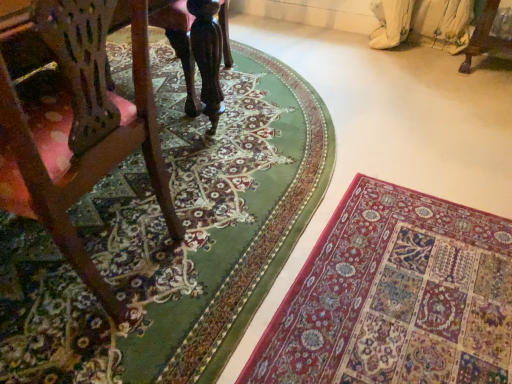
Image resolution: width=512 pixels, height=384 pixels. Describe the element at coordinates (169, 238) in the screenshot. I see `carpeted floor at lower right, the 1th mat when ordered from left to right` at that location.

The image size is (512, 384). What do you see at coordinates (75, 122) in the screenshot? I see `wooden chair at left` at bounding box center [75, 122].

The height and width of the screenshot is (384, 512). What are the coordinates of `carpeted floor at lower right, the 1th mat when ordered from left to right` in the screenshot? It's located at [x=169, y=238].

Is rich red carpet at lower right, the 2th mat in the left-to-right sequence, shorter than wooden chair at left?

Yes, rich red carpet at lower right, the 2th mat in the left-to-right sequence, is shorter than wooden chair at left.

Identify the location of the 1st mat behind the wooden chair at left, counting from the anchor's position. (395, 297).

Is rich red carpet at lower right, the 2th mat in the left-to-right sequence, next to wooden chair at left and touching it?

No, rich red carpet at lower right, the 2th mat in the left-to-right sequence, is not beside wooden chair at left.

Looking at this image, could you tell me if rich red carpet at lower right, the 2th mat in the left-to-right sequence, is facing wooden chair at left?

No, rich red carpet at lower right, the 2th mat in the left-to-right sequence, is not aimed at wooden chair at left.

Based on the photo, from a real-world perspective, is wooden chair at left physically located above or below carpeted floor at lower right, the second mat when ordered from right to left?

From a real-world perspective, wooden chair at left is physically above carpeted floor at lower right, the second mat when ordered from right to left.

Are wooden chair at left and carpeted floor at lower right, the second mat when ordered from right to left, far apart?

wooden chair at left is actually quite close to carpeted floor at lower right, the second mat when ordered from right to left.

Could you measure the distance between wooden chair at left and carpeted floor at lower right, the 1th mat when ordered from left to right?

wooden chair at left and carpeted floor at lower right, the 1th mat when ordered from left to right, are 17.44 inches apart.

Is wooden chair at left further to camera compared to carpeted floor at lower right, the second mat when ordered from right to left?

No.

How different are the orientations of carpeted floor at lower right, the second mat when ordered from right to left, and rich red carpet at lower right, the 2th mat in the left-to-right sequence, in degrees?

carpeted floor at lower right, the second mat when ordered from right to left, and rich red carpet at lower right, the 2th mat in the left-to-right sequence, are facing 1.25 degrees away from each other.

From the image's perspective, relative to rich red carpet at lower right, positioned as the first mat in right-to-left order, is carpeted floor at lower right, the second mat when ordered from right to left, above or below?

Clearly, from the image's perspective, carpeted floor at lower right, the second mat when ordered from right to left, is above rich red carpet at lower right, positioned as the first mat in right-to-left order.

In terms of width, does carpeted floor at lower right, the second mat when ordered from right to left, look wider or thinner when compared to rich red carpet at lower right, positioned as the first mat in right-to-left order?

In the image, carpeted floor at lower right, the second mat when ordered from right to left, appears to be wider than rich red carpet at lower right, positioned as the first mat in right-to-left order.

Are carpeted floor at lower right, the second mat when ordered from right to left, and rich red carpet at lower right, the 2th mat in the left-to-right sequence, located far from each other?

No, carpeted floor at lower right, the second mat when ordered from right to left, is not far away from rich red carpet at lower right, the 2th mat in the left-to-right sequence.

Is wooden chair at left far from rich red carpet at lower right, positioned as the first mat in right-to-left order?

wooden chair at left is actually quite close to rich red carpet at lower right, positioned as the first mat in right-to-left order.

From the image's perspective, is wooden chair at left on top of rich red carpet at lower right, positioned as the first mat in right-to-left order?

Correct, wooden chair at left appears higher than rich red carpet at lower right, positioned as the first mat in right-to-left order, in the image.

Between wooden chair at left and rich red carpet at lower right, positioned as the first mat in right-to-left order, which one appears on the right side from the viewer's perspective?

rich red carpet at lower right, positioned as the first mat in right-to-left order.

How different are the orientations of wooden chair at left and rich red carpet at lower right, the 2th mat in the left-to-right sequence, in degrees?

The angular difference between wooden chair at left and rich red carpet at lower right, the 2th mat in the left-to-right sequence, is 3.91 degrees.

Based on their positions, is carpeted floor at lower right, the 1th mat when ordered from left to right, located to the left or right of wooden chair at left?

Based on their positions, carpeted floor at lower right, the 1th mat when ordered from left to right, is located to the right of wooden chair at left.

From the image's perspective, which is below, carpeted floor at lower right, the second mat when ordered from right to left, or wooden chair at left?

wooden chair at left.

You are a GUI agent. You are given a task and a screenshot of the screen. Output one action in this format:
    pyautogui.click(x=<x>, y=<y>)
    Task: Click on the mat above the wooden chair at left (from the image's perspective)
    
    Given the screenshot: What is the action you would take?
    pyautogui.click(x=169, y=238)

Is carpeted floor at lower right, the 1th mat when ordered from left to right, positioned in front of wooden chair at left?

No, it is not.

Image resolution: width=512 pixels, height=384 pixels. In order to click on mat beneath the carpeted floor at lower right, the second mat when ordered from right to left (from a real-world perspective) in this screenshot , I will do `click(395, 297)`.

Can you confirm if rich red carpet at lower right, positioned as the first mat in right-to-left order, is bigger than carpeted floor at lower right, the 1th mat when ordered from left to right?

No.

In terms of height, does rich red carpet at lower right, the 2th mat in the left-to-right sequence, look taller or shorter compared to carpeted floor at lower right, the 1th mat when ordered from left to right?

rich red carpet at lower right, the 2th mat in the left-to-right sequence, is shorter than carpeted floor at lower right, the 1th mat when ordered from left to right.

Does rich red carpet at lower right, positioned as the first mat in right-to-left order, turn towards carpeted floor at lower right, the second mat when ordered from right to left?

Yes, rich red carpet at lower right, positioned as the first mat in right-to-left order, is turned towards carpeted floor at lower right, the second mat when ordered from right to left.

At what (x,y) coordinates should I click in order to perform the action: click on the 2nd mat directly beneath the wooden chair at left (from a real-world perspective). Please return your answer as a coordinate pair (x, y). This screenshot has height=384, width=512. Looking at the image, I should click on (395, 297).

From the wooden chair at left, count 2nd mats backward and point to it. Please provide its 2D coordinates.

[(169, 238)]

Which object lies further to the anchor point carpeted floor at lower right, the second mat when ordered from right to left, rich red carpet at lower right, the 2th mat in the left-to-right sequence, or wooden chair at left?

wooden chair at left is positioned further to the anchor carpeted floor at lower right, the second mat when ordered from right to left.

From the image, which object appears to be farther from wooden chair at left, carpeted floor at lower right, the 1th mat when ordered from left to right, or rich red carpet at lower right, positioned as the first mat in right-to-left order?

Among the two, rich red carpet at lower right, positioned as the first mat in right-to-left order, is located further to wooden chair at left.

In the scene shown: Considering their positions, is wooden chair at left positioned further to rich red carpet at lower right, the 2th mat in the left-to-right sequence, than carpeted floor at lower right, the second mat when ordered from right to left?

Among the two, wooden chair at left is located further to rich red carpet at lower right, the 2th mat in the left-to-right sequence.

Based on their spatial positions, is wooden chair at left or rich red carpet at lower right, the 2th mat in the left-to-right sequence, closer to carpeted floor at lower right, the second mat when ordered from right to left?

Among the two, rich red carpet at lower right, the 2th mat in the left-to-right sequence, is located nearer to carpeted floor at lower right, the second mat when ordered from right to left.

When comparing their distances from wooden chair at left, does rich red carpet at lower right, the 2th mat in the left-to-right sequence, or carpeted floor at lower right, the second mat when ordered from right to left, seem closer?

The object closer to wooden chair at left is carpeted floor at lower right, the second mat when ordered from right to left.

From the image, which object appears to be nearer to rich red carpet at lower right, the 2th mat in the left-to-right sequence, carpeted floor at lower right, the 1th mat when ordered from left to right, or wooden chair at left?

Among the two, carpeted floor at lower right, the 1th mat when ordered from left to right, is located nearer to rich red carpet at lower right, the 2th mat in the left-to-right sequence.

Where is `mat between wooden chair at left and rich red carpet at lower right, positioned as the first mat in right-to-left order, from left to right`? Image resolution: width=512 pixels, height=384 pixels. mat between wooden chair at left and rich red carpet at lower right, positioned as the first mat in right-to-left order, from left to right is located at coordinates (169, 238).